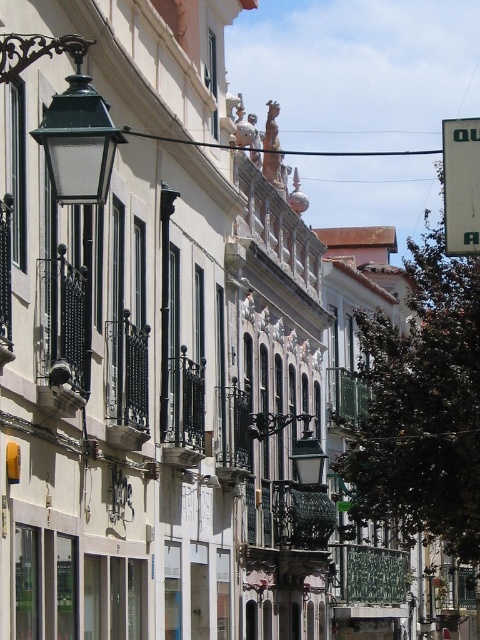
You are a tourist standing on the street looking at the buildings. You notice the green matte streetlamp at upper left and the white plastic sign at upper right. Which object is positioned lower in the image?

The green matte streetlamp at upper left is positioned below the white plastic sign at upper right, so it is lower in the image.

You are a city planner assessing the street layout. You need to determine if the green matte streetlamp at upper left can be replaced with a wider model without exceeding the width of the white plastic sign at upper right. Can it?

The green matte streetlamp at upper left is narrower than the white plastic sign at upper right, so replacing it with a wider model might exceed the sign. Check the new lamp width against the sign.